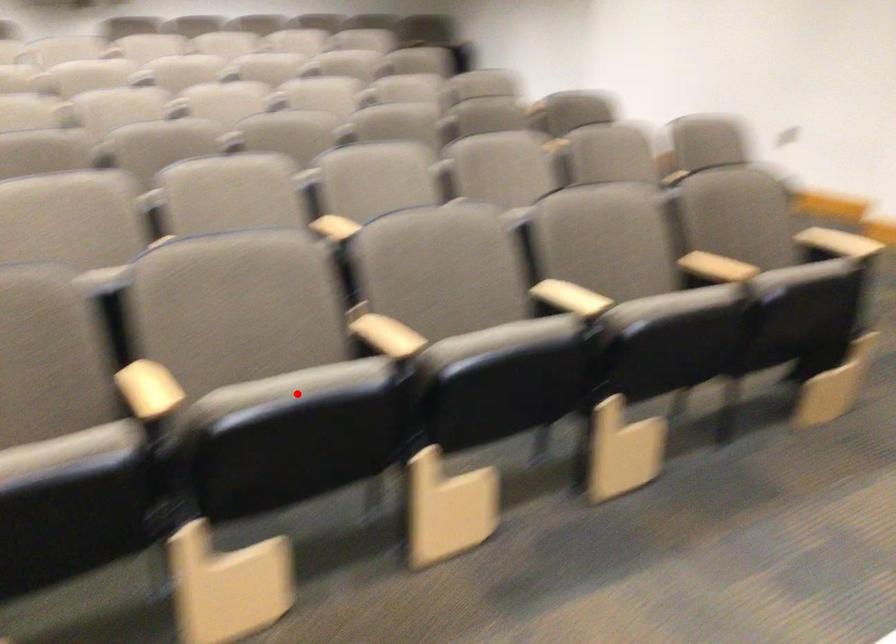
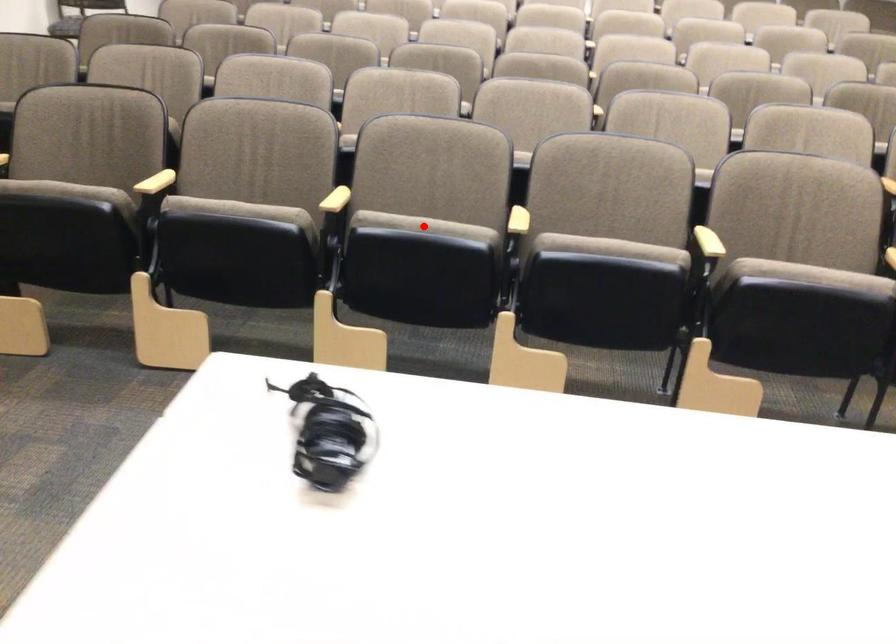
I am providing you with two images of the same scene from different viewpoints. A red point is marked on the first image and another point is marked on the second image. Is the marked point in image1 the same physical position as the marked point in image2?

Yes